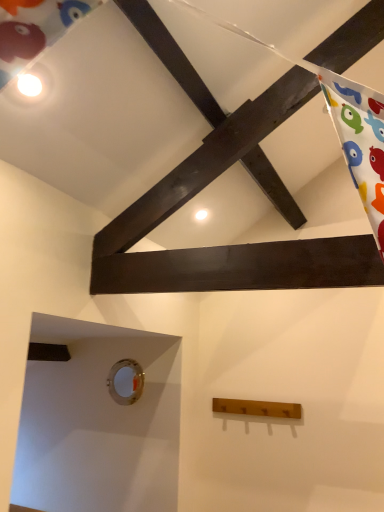
Measure the distance between wooden coat rack at lower center and camera.

2.47 meters.

The image size is (384, 512). Find the location of `wooden coat rack at lower center`. wooden coat rack at lower center is located at coordinates (257, 408).

Image resolution: width=384 pixels, height=512 pixels. Describe the element at coordinates (257, 408) in the screenshot. I see `wooden coat rack at lower center` at that location.

Measure the distance between point (124, 401) and camera.

Point (124, 401) is 8.91 feet away from camera.

The width and height of the screenshot is (384, 512). What are the coordinates of `metallic circular hole at lower left` in the screenshot? It's located at (125, 381).

Describe the element at coordinates (125, 381) in the screenshot. I see `metallic circular hole at lower left` at that location.

Where is `wooden coat rack at lower center`? This screenshot has height=512, width=384. wooden coat rack at lower center is located at coordinates (257, 408).

Between metallic circular hole at lower left and wooden coat rack at lower center, which one appears on the right side from the viewer's perspective?

From the viewer's perspective, wooden coat rack at lower center appears more on the right side.

Is the position of metallic circular hole at lower left less distant than that of wooden coat rack at lower center?

No, the depth of metallic circular hole at lower left is greater than that of wooden coat rack at lower center.

Does point (129, 370) appear closer or farther from the camera than point (242, 402)?

Point (129, 370) is farther from the camera than point (242, 402).

From the image's perspective, is metallic circular hole at lower left on wooden coat rack at lower center?

Yes.

From a real-world perspective, is metallic circular hole at lower left positioned above or below wooden coat rack at lower center?

In terms of real-world spatial position, metallic circular hole at lower left is above wooden coat rack at lower center.

Can you confirm if metallic circular hole at lower left is thinner than wooden coat rack at lower center?

Yes, metallic circular hole at lower left is thinner than wooden coat rack at lower center.

Considering the relative sizes of metallic circular hole at lower left and wooden coat rack at lower center in the image provided, is metallic circular hole at lower left shorter than wooden coat rack at lower center?

No, metallic circular hole at lower left is not shorter than wooden coat rack at lower center.

Looking at the image, does metallic circular hole at lower left seem bigger or smaller compared to wooden coat rack at lower center?

In the image, metallic circular hole at lower left appears to be smaller than wooden coat rack at lower center.

Is metallic circular hole at lower left surrounding wooden coat rack at lower center?

No, wooden coat rack at lower center is not a part of metallic circular hole at lower left.

Does metallic circular hole at lower left touch wooden coat rack at lower center?

No, metallic circular hole at lower left is not with wooden coat rack at lower center.

Is metallic circular hole at lower left oriented away from wooden coat rack at lower center?

No, metallic circular hole at lower left is not facing the opposite direction of wooden coat rack at lower center.

How different are the orientations of metallic circular hole at lower left and wooden coat rack at lower center in degrees?

The angle between the facing direction of metallic circular hole at lower left and the facing direction of wooden coat rack at lower center is 0.812 degrees.

Where is `plank on the right of metallic circular hole at lower left`? The height and width of the screenshot is (512, 384). plank on the right of metallic circular hole at lower left is located at coordinates (257, 408).

Considering the relative positions of wooden coat rack at lower center and metallic circular hole at lower left in the image provided, is wooden coat rack at lower center to the left or to the right of metallic circular hole at lower left?

In the image, wooden coat rack at lower center appears on the right side of metallic circular hole at lower left.

Is wooden coat rack at lower center in front of or behind metallic circular hole at lower left in the image?

Clearly, wooden coat rack at lower center is in front of metallic circular hole at lower left.

Is point (289, 416) closer or farther from the camera than point (123, 390)?

Clearly, point (289, 416) is closer to the camera than point (123, 390).

From the image's perspective, does wooden coat rack at lower center appear higher than metallic circular hole at lower left?

No, from the image's perspective, wooden coat rack at lower center is not on top of metallic circular hole at lower left.

From a real-world perspective, is wooden coat rack at lower center beneath metallic circular hole at lower left?

Indeed, from a real-world perspective, wooden coat rack at lower center is positioned beneath metallic circular hole at lower left.

Considering the relative sizes of wooden coat rack at lower center and metallic circular hole at lower left in the image provided, is wooden coat rack at lower center thinner than metallic circular hole at lower left?

No.

Who is taller, wooden coat rack at lower center or metallic circular hole at lower left?

metallic circular hole at lower left.

Does wooden coat rack at lower center have a larger size compared to metallic circular hole at lower left?

Indeed, wooden coat rack at lower center has a larger size compared to metallic circular hole at lower left.

Is wooden coat rack at lower center outside of metallic circular hole at lower left?

Indeed, wooden coat rack at lower center is completely outside metallic circular hole at lower left.

Is wooden coat rack at lower center next to metallic circular hole at lower left and touching it?

No, wooden coat rack at lower center is not beside metallic circular hole at lower left.

Could you tell me if wooden coat rack at lower center is turned towards metallic circular hole at lower left?

No, wooden coat rack at lower center is not aimed at metallic circular hole at lower left.

What's the angular difference between wooden coat rack at lower center and metallic circular hole at lower left's facing directions?

0.812 degrees.

This screenshot has height=512, width=384. I want to click on hole on the left of wooden coat rack at lower center, so click(125, 381).

Where is `plank located below the metallic circular hole at lower left (from the image's perspective)`? The height and width of the screenshot is (512, 384). plank located below the metallic circular hole at lower left (from the image's perspective) is located at coordinates (257, 408).

The height and width of the screenshot is (512, 384). In order to click on plank that is on the right side of metallic circular hole at lower left in this screenshot , I will do `click(257, 408)`.